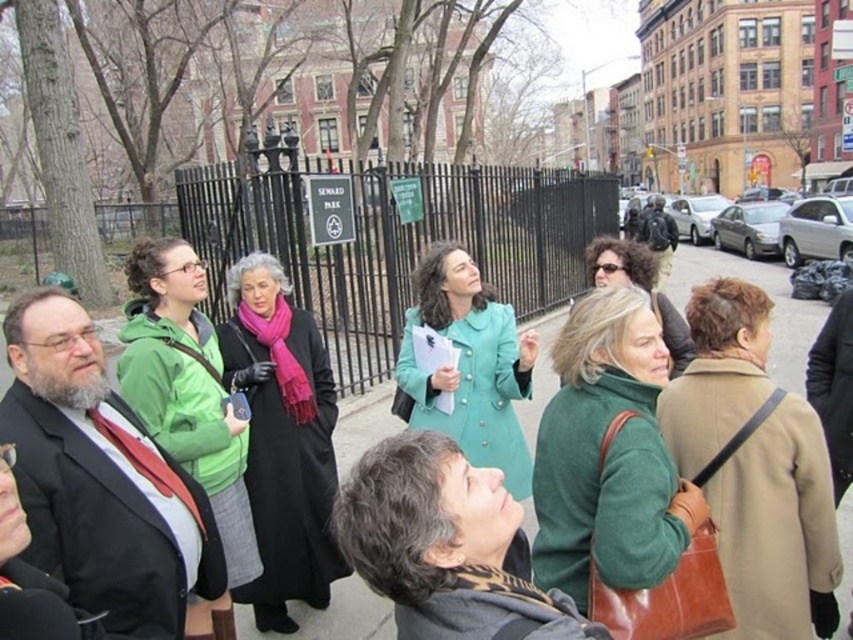
Question: Is green matte jacket at center in front of teal fabric coat at center?

Choices:
 (A) yes
 (B) no

Answer: (A)

Question: Does brown leather coat at center have a smaller size compared to pavement at center?

Choices:
 (A) yes
 (B) no

Answer: (A)

Question: Estimate the real-world distances between objects in this image. Which object is closer to the green matte jacket at center?

Choices:
 (A) teal fabric coat at center
 (B) brown leather coat at center
 (C) green matte sweater at center

Answer: (A)

Question: Which of the following is the farthest from the observer?

Choices:
 (A) brown leather coat at center
 (B) teal fabric coat at center

Answer: (B)

Question: Is matte black coat at center positioned behind green matte jacket at center?

Choices:
 (A) no
 (B) yes

Answer: (B)

Question: Which object is farther from the camera taking this photo?

Choices:
 (A) brown leather coat at center
 (B) green matte jacket at center

Answer: (B)